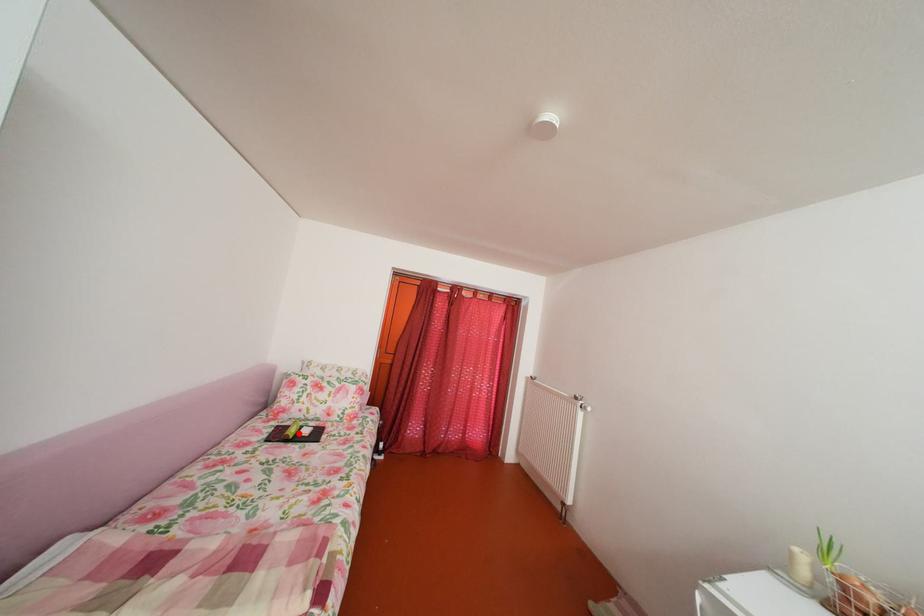
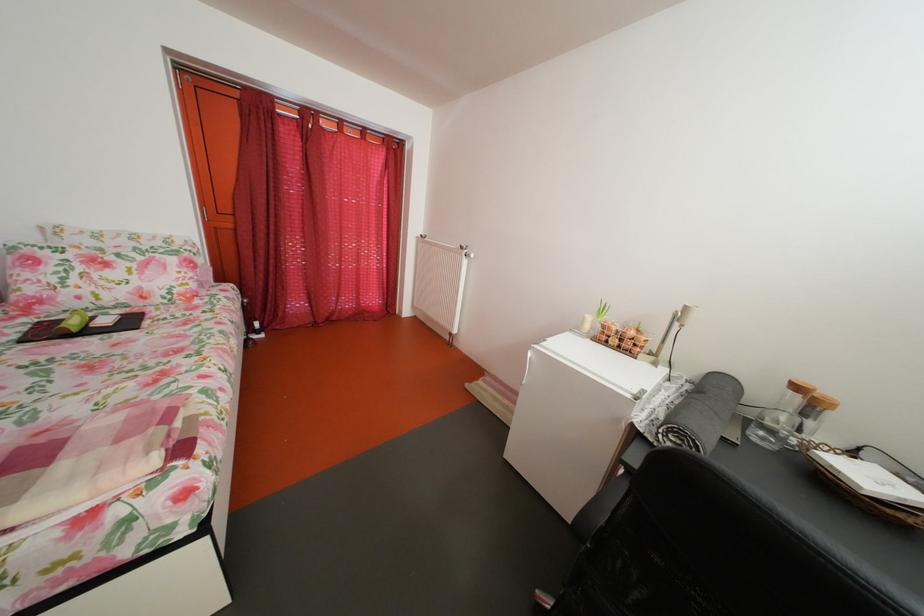
Question: I am providing you with two images of the same scene from different viewpoints. In image1, a red point is highlighted. Considering the same 3D point in image2, which of the following is correct?

Choices:
 (A) It is closer
 (B) It is farther

Answer: (A)